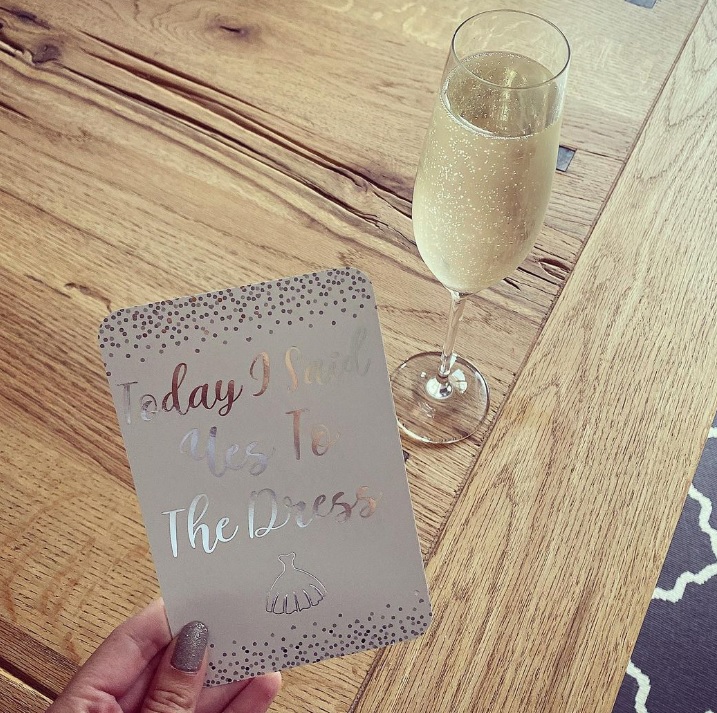
At what (x,y) coordinates should I click in order to perform the action: click on wine glass. Please return your answer as a coordinate pair (x, y). This screenshot has height=713, width=717. Looking at the image, I should click on (451, 406).